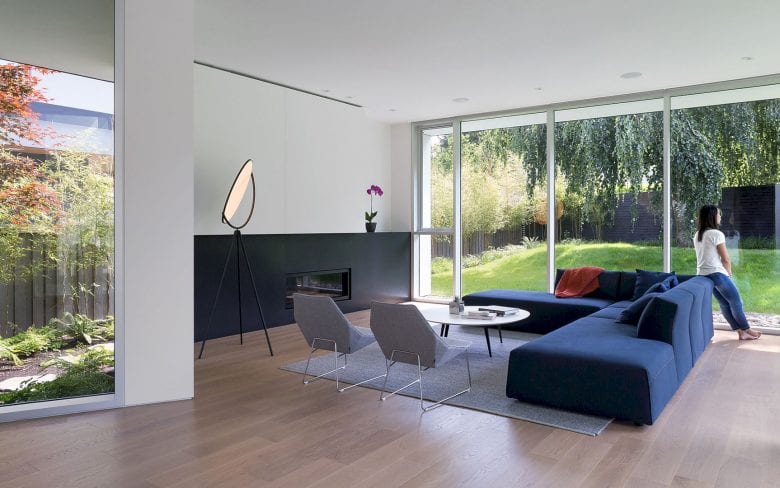
At what (x,y) coordinates should I click in order to perform the action: click on blue couch. Please return your answer as a coordinate pair (x, y). The width and height of the screenshot is (780, 488). Looking at the image, I should click on pos(611,333).